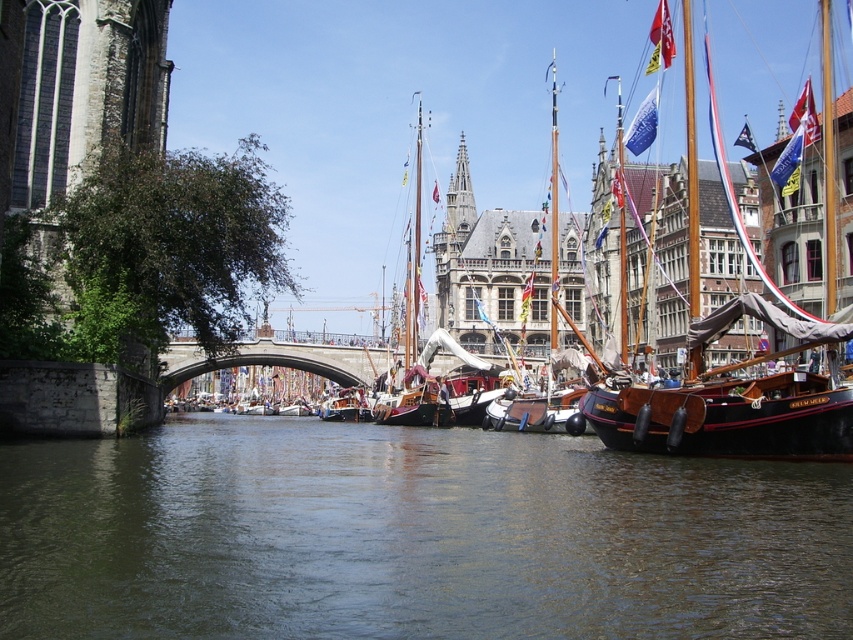
Question: Is dark green water at center thinner than wooden sailboat at right?

Choices:
 (A) yes
 (B) no

Answer: (B)

Question: Which of the following is the farthest from the observer?

Choices:
 (A) (675, 440)
 (B) (328, 433)
 (C) (552, 221)

Answer: (C)

Question: Among these objects, which one is nearest to the camera?

Choices:
 (A) dark green water at center
 (B) wooden sailboat at right

Answer: (A)

Question: Where is dark green water at center located in relation to wooden sailboat at right in the image?

Choices:
 (A) below
 (B) above

Answer: (A)

Question: Based on their relative distances, which object is nearer to the dark green water at center?

Choices:
 (A) wooden sailboat at center
 (B) wooden sailboat at right

Answer: (B)

Question: Is dark green water at center positioned before wooden sailboat at center?

Choices:
 (A) yes
 (B) no

Answer: (A)